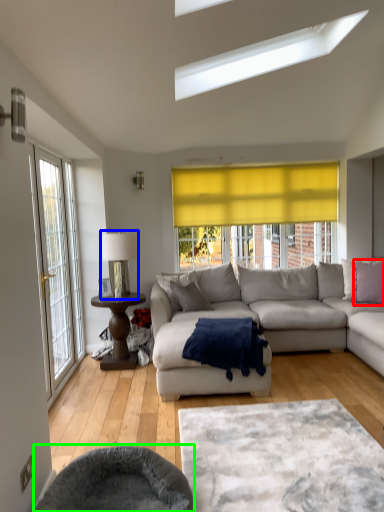
Question: Which object is positioned closest to pillow (highlighted by a red box)? Select from table lamp (highlighted by a blue box) and swivel chair (highlighted by a green box).

Choices:
 (A) table lamp
 (B) swivel chair

Answer: (A)